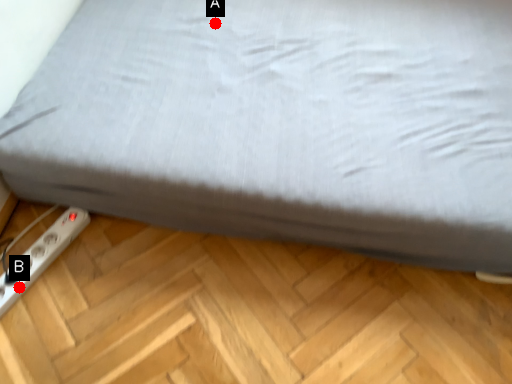
Question: Two points are circled on the image, labeled by A and B beside each circle. Which point is closer to the camera?

Choices:
 (A) A is closer
 (B) B is closer

Answer: (B)